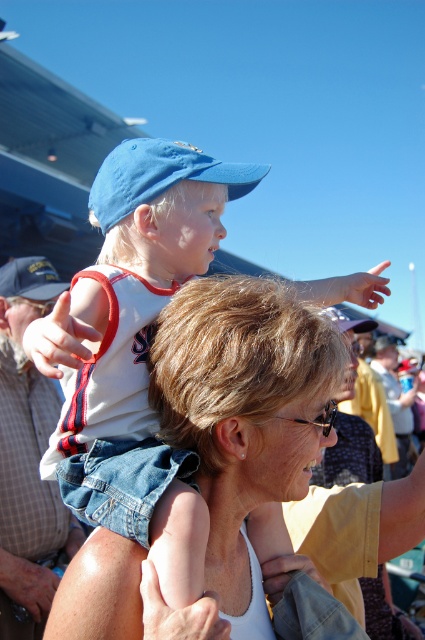
Who is shorter, matte blue cap at upper left or matte blue baseball cap at upper left?

With less height is matte blue baseball cap at upper left.

Between point (88, 436) and point (31, 260), which one is positioned in front?

Point (88, 436) is more forward.

Identify the location of matte blue cap at upper left. The height and width of the screenshot is (640, 425). (139, 346).

Does blue fabric baseball cap at upper center have a greater width compared to matte blue baseball cap at upper left?

Yes, blue fabric baseball cap at upper center is wider than matte blue baseball cap at upper left.

Is point (133, 195) more distant than point (14, 268)?

No, (133, 195) is closer to viewer.

You are a GUI agent. You are given a task and a screenshot of the screen. Output one action in this format:
    pyautogui.click(x=<x>, y=<y>)
    Task: Click on the blue fabric baseball cap at upper center
    
    Given the screenshot: What is the action you would take?
    pyautogui.click(x=159, y=176)

Who is taller, matte blue cap at upper left or blue fabric baseball cap at upper center?

With more height is matte blue cap at upper left.

Which is below, matte blue cap at upper left or blue fabric baseball cap at upper center?

matte blue cap at upper left is lower down.

Who is more distant from viewer, [152,189] or [122,177]?

Positioned behind is point [122,177].

Identify the location of matte blue cap at upper left. This screenshot has width=425, height=640. (139, 346).